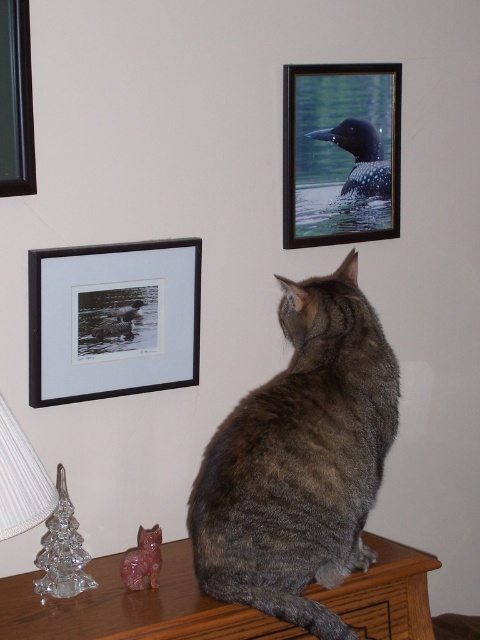
You are a photographer trying to capture a photo of the gray fur cat at center and the wooden frame at upper right. Based on their positions, which object is closer to the camera?

The gray fur cat at center is closer to the camera because it is below the wooden frame at upper right, meaning the cat is positioned in front of the frame.

You are a photographer adjusting your camera to focus on the tabby cat sitting on the wooden surface. The camera has a focus point at point [112,320]. Based on the scene description, will this focus point land on the cat?

The focus point at point [112,320] is on the black matte frame at upper left, so no, the focus point will not land on the cat because it is positioned on the frame instead.

You are standing in the room and see the two points on the wooden surface where the tabby cat is sitting. Which point is closer to you, point (x=63, y=276) or point (x=23, y=17)?

Point (x=63, y=276) is further to the camera than point (x=23, y=17), so point (x=23, y=17) is closer to you.